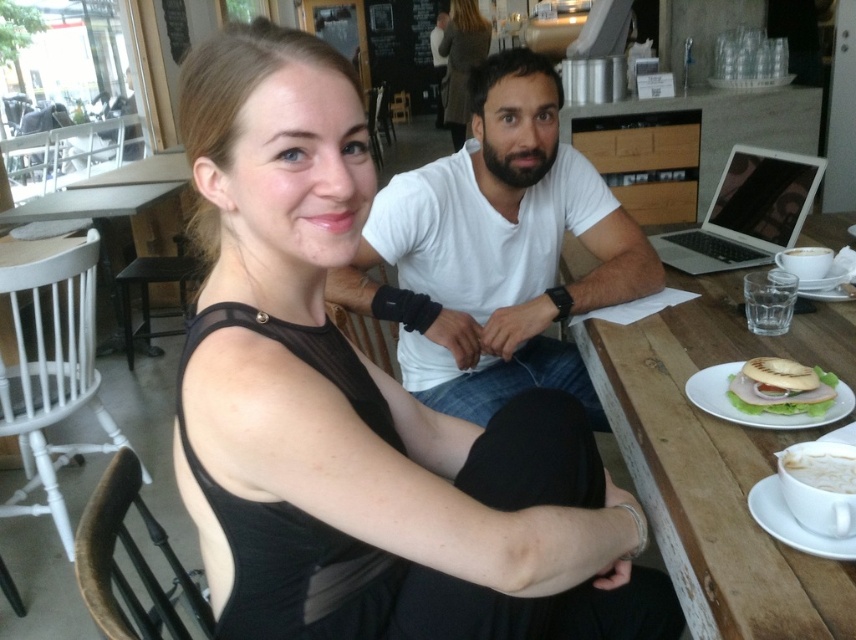
Which of these two, wooden table at center or silver metallic laptop at upper right, stands shorter?

silver metallic laptop at upper right is shorter.

Is wooden table at center positioned before silver metallic laptop at upper right?

Yes, wooden table at center is closer to the viewer.

Does point (673, 333) lie in front of point (681, 250)?

Yes, point (673, 333) is closer to viewer.

You are a GUI agent. You are given a task and a screenshot of the screen. Output one action in this format:
    pyautogui.click(x=<x>, y=<y>)
    Task: Click on the wooden table at center
    Image resolution: width=856 pixels, height=640 pixels.
    Given the screenshot: What is the action you would take?
    pyautogui.click(x=718, y=460)

Is black mesh dress at center taller than wooden table at center?

Yes.

Find the location of `black mesh dress at center`. black mesh dress at center is located at coordinates (361, 410).

Who is higher up, silver metallic laptop at upper right or white matte cup at upper right?

Positioned higher is silver metallic laptop at upper right.

Looking at this image, does silver metallic laptop at upper right have a greater width compared to white matte cup at upper right?

Correct, the width of silver metallic laptop at upper right exceeds that of white matte cup at upper right.

Find the location of a particular element. This screenshot has height=640, width=856. silver metallic laptop at upper right is located at coordinates (746, 212).